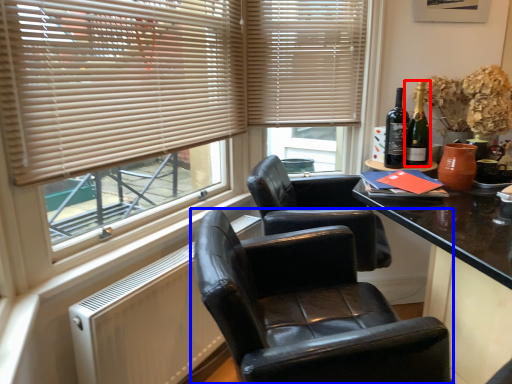
Question: Among these objects, which one is farthest to the camera, bottle (highlighted by a red box) or chair (highlighted by a blue box)?

Choices:
 (A) bottle
 (B) chair

Answer: (A)